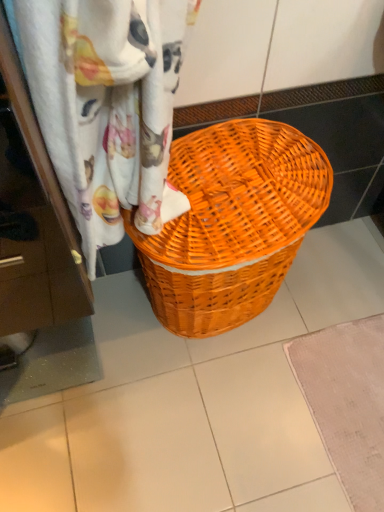
Question: Is woven fabric curtain at upper center at the right side of orange wicker basket at center?

Choices:
 (A) yes
 (B) no

Answer: (B)

Question: Considering the relative sizes of woven fabric curtain at upper center and orange wicker basket at center in the image provided, is woven fabric curtain at upper center taller than orange wicker basket at center?

Choices:
 (A) yes
 (B) no

Answer: (B)

Question: Is woven fabric curtain at upper center thinner than orange wicker basket at center?

Choices:
 (A) no
 (B) yes

Answer: (B)

Question: Is woven fabric curtain at upper center bigger than orange wicker basket at center?

Choices:
 (A) no
 (B) yes

Answer: (A)

Question: Does woven fabric curtain at upper center touch orange wicker basket at center?

Choices:
 (A) no
 (B) yes

Answer: (A)

Question: Considering the positions of orange wicker basket at center and woven fabric curtain at upper center in the image, is orange wicker basket at center wider or thinner than woven fabric curtain at upper center?

Choices:
 (A) wide
 (B) thin

Answer: (A)

Question: Considering their positions, is orange wicker basket at center located in front of or behind woven fabric curtain at upper center?

Choices:
 (A) behind
 (B) front

Answer: (A)

Question: From a real-world perspective, is orange wicker basket at center physically located above or below woven fabric curtain at upper center?

Choices:
 (A) above
 (B) below

Answer: (B)

Question: Would you say orange wicker basket at center is to the left or to the right of woven fabric curtain at upper center in the picture?

Choices:
 (A) right
 (B) left

Answer: (A)

Question: Is point click(x=218, y=268) positioned closer to the camera than point click(x=377, y=417)?

Choices:
 (A) farther
 (B) closer

Answer: (B)

Question: From the image's perspective, relative to beige textured bath mat at lower right, is orange wicker basket at center above or below?

Choices:
 (A) below
 (B) above

Answer: (B)

Question: In terms of width, does orange wicker basket at center look wider or thinner when compared to beige textured bath mat at lower right?

Choices:
 (A) wide
 (B) thin

Answer: (B)

Question: From a real-world perspective, is orange wicker basket at center above or below beige textured bath mat at lower right?

Choices:
 (A) above
 (B) below

Answer: (A)

Question: Considering the positions of point (331, 384) and point (215, 293), is point (331, 384) closer or farther from the camera than point (215, 293)?

Choices:
 (A) closer
 (B) farther

Answer: (B)

Question: Relative to orange wicker basket at center, is beige textured bath mat at lower right in front or behind?

Choices:
 (A) behind
 (B) front

Answer: (A)